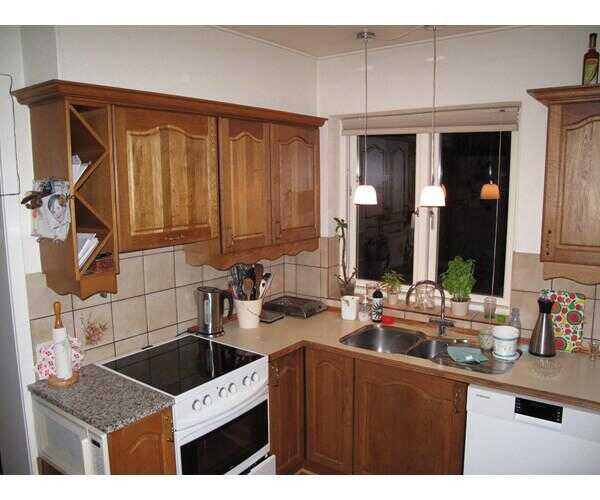
Locate an element on the screen. This screenshot has width=600, height=500. cream colored ceiling, background is located at coordinates (452, 29).